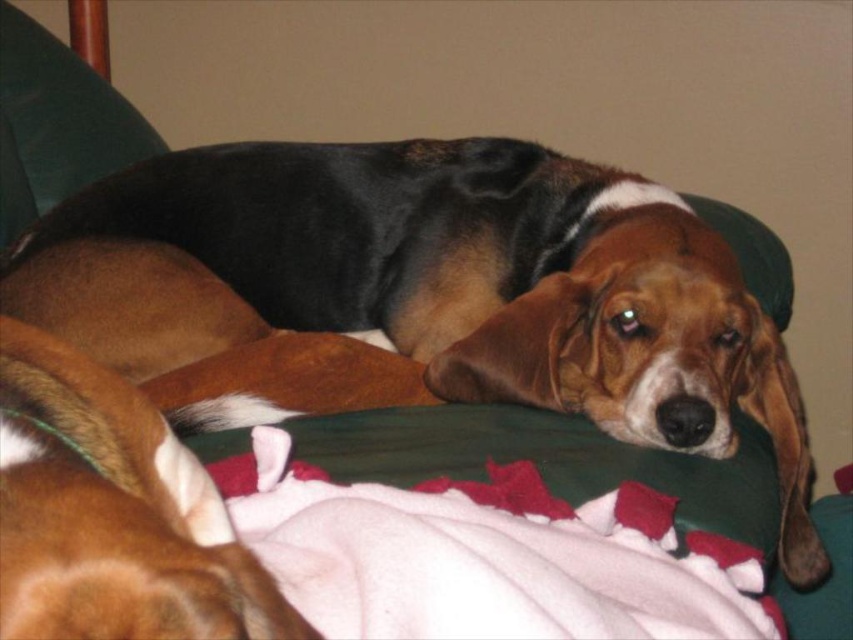
Between point (207, 154) and point (27, 577), which one is positioned behind?

The point (207, 154) is behind.

Does brown fur dog at center have a greater height compared to brown furry dog at center?

Yes.

Is point (535, 264) less distant than point (263, 605)?

No, it is behind (263, 605).

At what (x,y) coordinates should I click in order to perform the action: click on brown fur dog at center. Please return your answer as a coordinate pair (x, y). This screenshot has width=853, height=640. Looking at the image, I should click on (418, 296).

Where is `brown fur dog at center`? The height and width of the screenshot is (640, 853). brown fur dog at center is located at coordinates (418, 296).

How far apart are brown fur dog at center and white fleece blanket at center?

brown fur dog at center and white fleece blanket at center are 13.89 inches apart.

I want to click on brown fur dog at center, so click(418, 296).

Between point (590, 634) and point (61, 518), which one is positioned in front?

Point (61, 518)

Consider the image. Between white fleece blanket at center and brown furry dog at center, which one has less height?

With less height is brown furry dog at center.

Does point (607, 580) lie behind point (109, 598)?

Yes, it is behind point (109, 598).

The image size is (853, 640). Find the location of `white fleece blanket at center`. white fleece blanket at center is located at coordinates (486, 556).